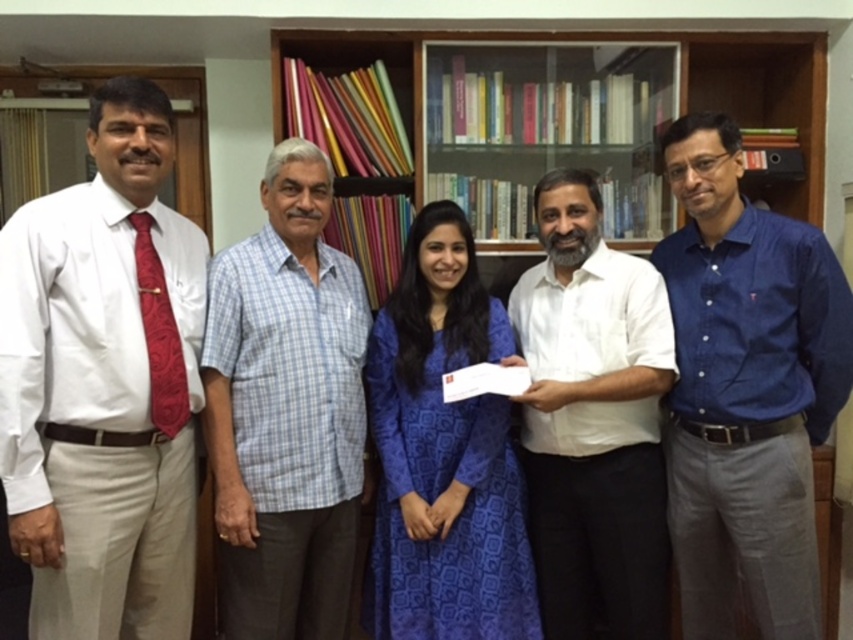
Who is positioned more to the left, white satin shirt at left or light blue checkered shirt at center?

Positioned to the left is white satin shirt at left.

Between white satin shirt at left and light blue checkered shirt at center, which one has more height?

light blue checkered shirt at center is taller.

Measure the distance between point (109,481) and camera.

The distance of point (109,481) from camera is 5.89 feet.

You are a GUI agent. You are given a task and a screenshot of the screen. Output one action in this format:
    pyautogui.click(x=<x>, y=<y>)
    Task: Click on the white satin shirt at left
    
    Given the screenshot: What is the action you would take?
    pyautogui.click(x=103, y=384)

Can you confirm if white satin shirt at left is smaller than blue button-down shirt at center?

Correct, white satin shirt at left occupies less space than blue button-down shirt at center.

Does point (140, 461) lie behind point (775, 492)?

No, (140, 461) is in front of (775, 492).

You are a GUI agent. You are given a task and a screenshot of the screen. Output one action in this format:
    pyautogui.click(x=<x>, y=<y>)
    Task: Click on the white satin shirt at left
    Image resolution: width=853 pixels, height=640 pixels.
    Given the screenshot: What is the action you would take?
    pyautogui.click(x=103, y=384)

Which is more to the right, light blue checkered shirt at center or blue printed dress at center?

blue printed dress at center

Can you confirm if light blue checkered shirt at center is bigger than blue printed dress at center?

Correct, light blue checkered shirt at center is larger in size than blue printed dress at center.

Which is in front, point (225, 611) or point (381, 332)?

Point (225, 611) is more forward.

Where is `light blue checkered shirt at center`? The height and width of the screenshot is (640, 853). light blue checkered shirt at center is located at coordinates 286,410.